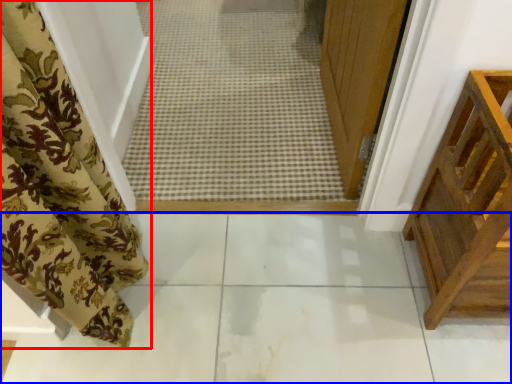
Question: Which of the following is the closest to the observer, curtain (highlighted by a red box) or path (highlighted by a blue box)?

Choices:
 (A) curtain
 (B) path

Answer: (A)